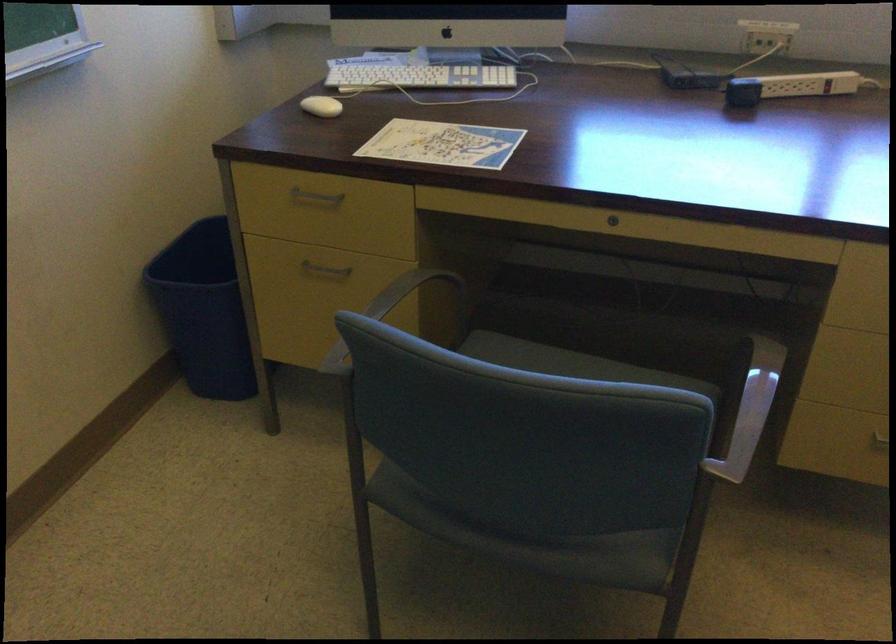
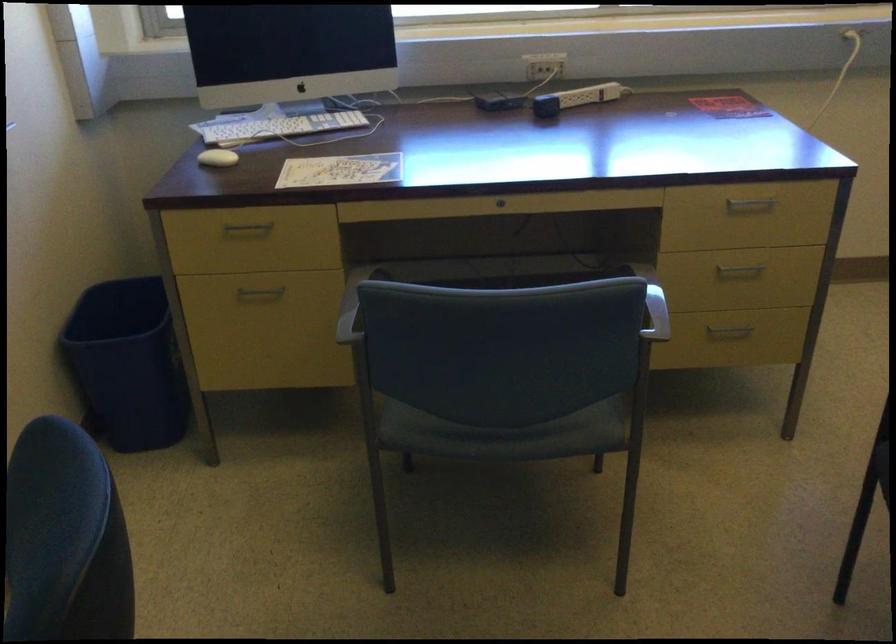
Question: The camera is either moving clockwise (left) or counter-clockwise (right) around the object. The first image is from the beginning of the video and the second image is from the end. Is the camera moving left or right when shooting the video?

Choices:
 (A) Left
 (B) Right

Answer: (A)